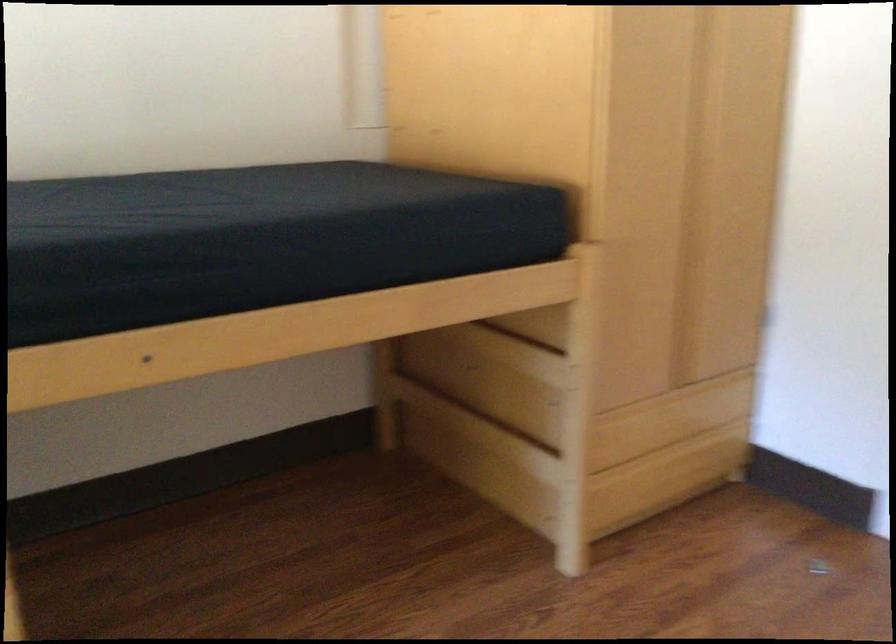
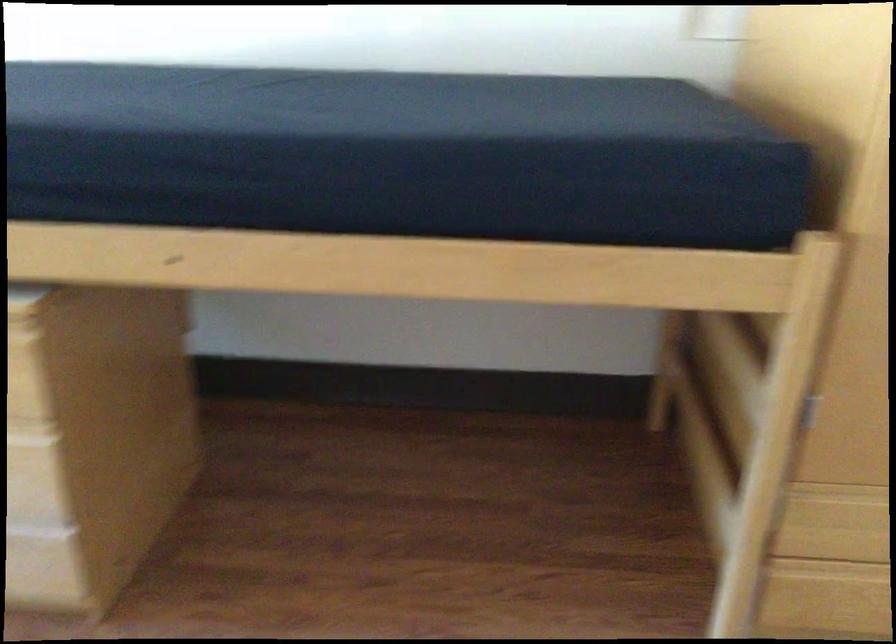
Question: The images are taken continuously from a first-person perspective. In which direction is your viewpoint rotating?

Choices:
 (A) Left
 (B) Right
 (C) Up
 (D) Down

Answer: (A)